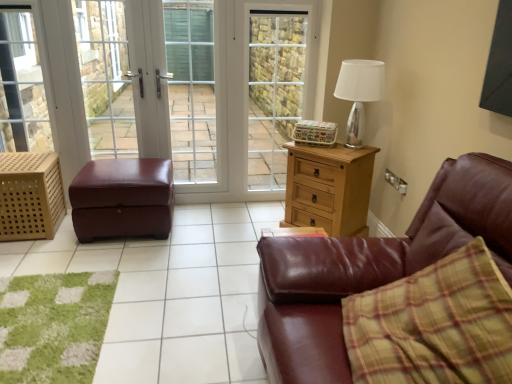
The width and height of the screenshot is (512, 384). What do you see at coordinates (359, 94) in the screenshot?
I see `silver metallic table lamp at upper right` at bounding box center [359, 94].

Where is `silver metallic table lamp at upper right`? Image resolution: width=512 pixels, height=384 pixels. silver metallic table lamp at upper right is located at coordinates (359, 94).

This screenshot has height=384, width=512. What do you see at coordinates (105, 78) in the screenshot?
I see `clear glass door at center` at bounding box center [105, 78].

You are a GUI agent. You are given a task and a screenshot of the screen. Output one action in this format:
    pyautogui.click(x=<x>, y=<y>)
    Task: Click on the clear glass window at left
    The image size is (512, 384).
    Given the screenshot: What is the action you would take?
    pyautogui.click(x=21, y=84)

Image resolution: width=512 pixels, height=384 pixels. What do you see at coordinates (191, 89) in the screenshot?
I see `matte white screen door at center, the 2th screen door positioned from the right` at bounding box center [191, 89].

Measure the distance between point (293,189) and camera.

Point (293,189) and camera are 9.70 feet apart.

Locate an element on the screen. The image size is (512, 384). silver metallic table lamp at upper right is located at coordinates (359, 94).

Based on their sizes in the image, would you say matte white screen door at center, the first screen door positioned from the left, is bigger or smaller than silver metallic table lamp at upper right?

Considering their sizes, matte white screen door at center, the first screen door positioned from the left, takes up more space than silver metallic table lamp at upper right.

From the image's perspective, starting from the silver metallic table lamp at upper right, which screen door is the 1st one above? Please provide its 2D coordinates.

[(191, 89)]

Is point (185, 159) closer to viewer compared to point (377, 82)?

No.

Can you confirm if brown leather ottoman at left is bigger than wooden lattice basket at left?

Correct, brown leather ottoman at left is larger in size than wooden lattice basket at left.

The width and height of the screenshot is (512, 384). In order to click on dresser that appears below the brown leather ottoman at left (from the image's perspective) in this screenshot , I will do `click(30, 196)`.

Is the surface of brown leather ottoman at left in direct contact with wooden lattice basket at left?

brown leather ottoman at left and wooden lattice basket at left are clearly separated.

How different are the orientations of brown leather ottoman at left and wooden lattice basket at left in degrees?

2.8 degrees.

Measure the distance from brown leather ottoman at center to burgundy leather ottoman at left.

They are 43.86 centimeters apart.

Which of these two, brown leather ottoman at center or burgundy leather ottoman at left, stands taller?

Standing taller between the two is burgundy leather ottoman at left.

Considering the sizes of objects brown leather ottoman at center and burgundy leather ottoman at left in the image provided, who is wider, brown leather ottoman at center or burgundy leather ottoman at left?

brown leather ottoman at center.

From a real-world perspective, is brown leather ottoman at center located higher than burgundy leather ottoman at left?

Actually, brown leather ottoman at center is physically below burgundy leather ottoman at left in the real world.

Considering the points (106, 137) and (154, 313), which point is behind, point (106, 137) or point (154, 313)?

The point (106, 137) is behind.

In terms of height, does clear glass door at center look taller or shorter compared to brown leather ottoman at center?

clear glass door at center is taller than brown leather ottoman at center.

Considering the relative sizes of clear glass door at center and brown leather ottoman at center in the image provided, is clear glass door at center thinner than brown leather ottoman at center?

Yes.

What's the angular difference between brown leather couch at right and clear glass screen door at center, the 2th screen door viewed from the left,'s facing directions?

87.6 degrees.

How far apart are brown leather couch at right and clear glass screen door at center, which is the 1th screen door in right-to-left order?

brown leather couch at right is 1.93 meters away from clear glass screen door at center, which is the 1th screen door in right-to-left order.

Are brown leather couch at right and clear glass screen door at center, which is the 1th screen door in right-to-left order, far apart?

Yes, brown leather couch at right is far from clear glass screen door at center, which is the 1th screen door in right-to-left order.

Would you say clear glass screen door at center, which is the 1th screen door in right-to-left order, is part of brown leather couch at right's contents?

No.

Considering the relative sizes of wooden lattice basket at left and brown leather couch at right in the image provided, is wooden lattice basket at left thinner than brown leather couch at right?

Indeed, wooden lattice basket at left has a lesser width compared to brown leather couch at right.

Consider the image. Is wooden lattice basket at left facing away from brown leather couch at right?

Result: No, wooden lattice basket at left's orientation is not away from brown leather couch at right.

Is wooden lattice basket at left to the left of brown leather couch at right from the viewer's perspective?

Correct, you'll find wooden lattice basket at left to the left of brown leather couch at right.

From the image's perspective, is wooden lattice basket at left above or below brown leather couch at right?

Clearly, from the image's perspective, wooden lattice basket at left is above brown leather couch at right.

Is clear glass screen door at center, the 2th screen door viewed from the left, not inside matte white screen door at center, the 2th screen door positioned from the right?

clear glass screen door at center, the 2th screen door viewed from the left, is positioned outside matte white screen door at center, the 2th screen door positioned from the right.

Who is smaller, clear glass screen door at center, which is the 1th screen door in right-to-left order, or matte white screen door at center, the 2th screen door positioned from the right?

matte white screen door at center, the 2th screen door positioned from the right.

From the image's perspective, which one is positioned higher, clear glass screen door at center, which is the 1th screen door in right-to-left order, or matte white screen door at center, the 2th screen door positioned from the right?

clear glass screen door at center, which is the 1th screen door in right-to-left order, from the image's perspective.

Relative to matte white screen door at center, the first screen door positioned from the left, is clear glass screen door at center, the 2th screen door viewed from the left, in front or behind?

clear glass screen door at center, the 2th screen door viewed from the left, is positioned farther from the viewer than matte white screen door at center, the first screen door positioned from the left.

Identify the location of table lamp below the matte white screen door at center, the 2th screen door positioned from the right (from the image's perspective). The image size is (512, 384). click(359, 94).

Image resolution: width=512 pixels, height=384 pixels. Find the location of `door behind the wooden lattice basket at left`. door behind the wooden lattice basket at left is located at coordinates (201, 89).

Looking at this image, considering their positions, is clear glass window at left positioned closer to brown leather ottoman at left than brown leather couch at right?

clear glass window at left is positioned closer to the anchor brown leather ottoman at left.

Estimate the real-world distances between objects in this image. Which object is further from matte white screen door at center, the 2th screen door positioned from the right, light brown wooden chest of drawers at center right or clear glass window at left?

light brown wooden chest of drawers at center right is further to matte white screen door at center, the 2th screen door positioned from the right.

Which object lies further to the anchor point silver metallic table lamp at upper right, clear glass door at center or brown leather ottoman at center?

The object further to silver metallic table lamp at upper right is clear glass door at center.

From the image, which object appears to be farther from burgundy leather ottoman at left, silver metallic table lamp at upper right or brown leather ottoman at center?

The object further to burgundy leather ottoman at left is silver metallic table lamp at upper right.

Which object lies nearer to the anchor point matte white screen door at center, the first screen door positioned from the left, burgundy leather ottoman at left or brown leather ottoman at left?

Based on the image, brown leather ottoman at left appears to be nearer to matte white screen door at center, the first screen door positioned from the left.

Based on their spatial positions, is brown leather ottoman at center or brown leather couch at right closer to clear glass door at center?

brown leather ottoman at center lies closer to clear glass door at center than the other object.

Considering their positions, is wooden lattice basket at left positioned closer to silver metallic table lamp at upper right than matte white screen door at center, the first screen door positioned from the left?

matte white screen door at center, the first screen door positioned from the left, lies closer to silver metallic table lamp at upper right than the other object.

Considering their positions, is silver metallic table lamp at upper right positioned further to matte white screen door at center, the first screen door positioned from the left, than wooden lattice basket at left?

Based on the image, silver metallic table lamp at upper right appears to be further to matte white screen door at center, the first screen door positioned from the left.

The height and width of the screenshot is (384, 512). What are the coordinates of `door between brown leather ottoman at center and clear glass door at center in the front-back direction` in the screenshot? It's located at (201, 89).

Where is `table lamp located between brown leather couch at right and brown leather ottoman at left in the depth direction`? This screenshot has width=512, height=384. table lamp located between brown leather couch at right and brown leather ottoman at left in the depth direction is located at coordinates (359, 94).

Find the location of a particular element. screen door between matte white screen door at center, the first screen door positioned from the left, and light brown wooden chest of drawers at center right is located at coordinates (275, 89).

The image size is (512, 384). I want to click on chest of drawers between wooden lattice basket at left and brown leather couch at right, so click(x=329, y=188).